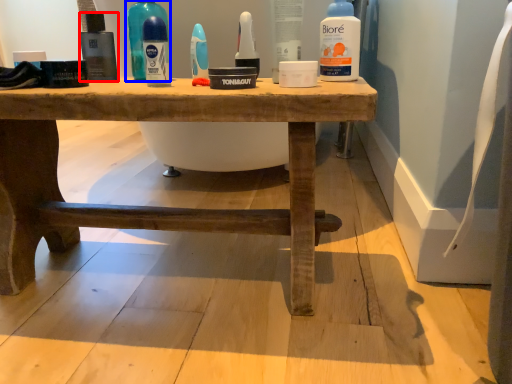
Question: Which object appears farthest to the camera in this image, mouthwash (highlighted by a red box) or cleaning product (highlighted by a blue box)?

Choices:
 (A) mouthwash
 (B) cleaning product

Answer: (A)